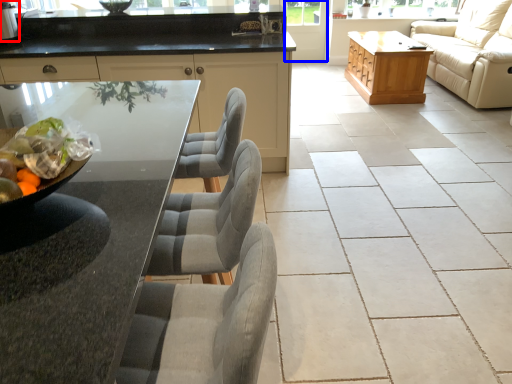
Question: Which object is closer to the camera taking this photo, appliance (highlighted by a red box) or screen door (highlighted by a blue box)?

Choices:
 (A) appliance
 (B) screen door

Answer: (A)